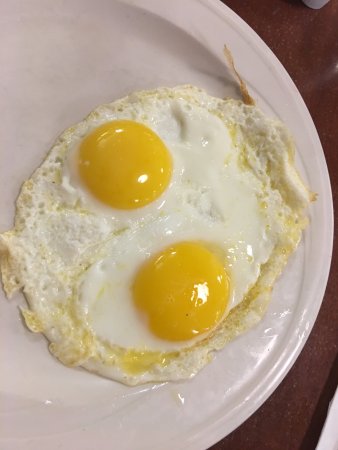
Locate an element on the screen. salt container is located at coordinates (318, 1).